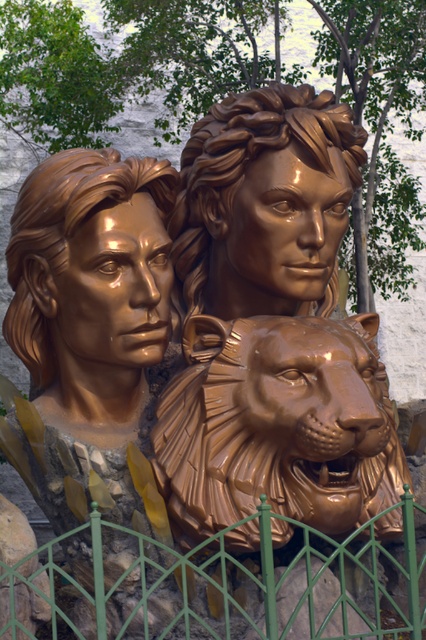
Question: Does shiny bronze lion at center have a larger size compared to shiny bronze face at center?

Choices:
 (A) no
 (B) yes

Answer: (B)

Question: Which point is farther to the camera?

Choices:
 (A) (264, 97)
 (B) (154, 232)
 (C) (120, 589)

Answer: (A)

Question: Is shiny bronze face at center thinner than glossy bronze face at center?

Choices:
 (A) no
 (B) yes

Answer: (B)

Question: Considering the real-world distances, which object is farthest from the glossy bronze face at center?

Choices:
 (A) shiny bronze face at center
 (B) shiny bronze lion at center
 (C) green metal fence at lower center

Answer: (C)

Question: Which object appears farthest from the camera in this image?

Choices:
 (A) green metal fence at lower center
 (B) shiny bronze face at center

Answer: (B)

Question: Can you confirm if shiny bronze lion at center is bigger than glossy bronze face at center?

Choices:
 (A) no
 (B) yes

Answer: (B)